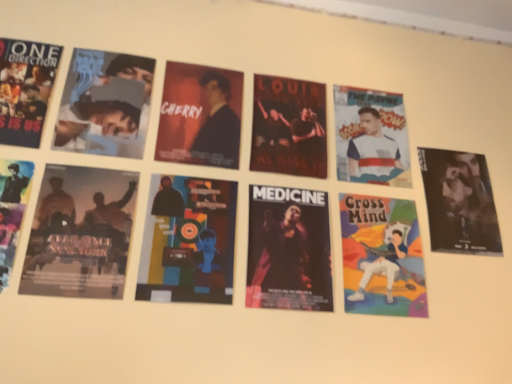
Question: From a real-world perspective, is matte black jacket at center, acting as the 3th person starting from the right, on top of silhouette paper poster at lower left, positioned as the 5th poster in right-to-left order?

Choices:
 (A) no
 (B) yes

Answer: (B)

Question: Considering the relative sizes of matte black jacket at center, the second person in the left-to-right sequence, and silhouette paper poster at lower left, positioned as the second poster in left-to-right order, in the image provided, is matte black jacket at center, the second person in the left-to-right sequence, wider than silhouette paper poster at lower left, positioned as the second poster in left-to-right order,?

Choices:
 (A) yes
 (B) no

Answer: (B)

Question: Is matte black jacket at center, the second person in the left-to-right sequence, positioned beyond the bounds of silhouette paper poster at lower left, positioned as the 5th poster in right-to-left order?

Choices:
 (A) no
 (B) yes

Answer: (B)

Question: Could you tell me if matte black jacket at center, the second person in the left-to-right sequence, is turned towards silhouette paper poster at lower left, positioned as the 5th poster in right-to-left order?

Choices:
 (A) no
 (B) yes

Answer: (A)

Question: Can you confirm if matte black jacket at center, acting as the 3th person starting from the right, is positioned to the left of silhouette paper poster at lower left, positioned as the second poster in left-to-right order?

Choices:
 (A) no
 (B) yes

Answer: (A)

Question: Is the position of matte black jacket at center, acting as the 3th person starting from the right, more distant than that of silhouette paper poster at lower left, positioned as the second poster in left-to-right order?

Choices:
 (A) no
 (B) yes

Answer: (B)

Question: Is shiny black jacket at right, the first person when ordered from right to left, completely or partially inside dark matte poster at center, arranged as the third poster when viewed from the right?

Choices:
 (A) no
 (B) yes

Answer: (A)

Question: Is dark matte poster at center, positioned as the fourth poster in left-to-right order, positioned far away from shiny black jacket at right, which is the fourth person in left-to-right order?

Choices:
 (A) yes
 (B) no

Answer: (B)

Question: Is dark matte poster at center, arranged as the third poster when viewed from the right, closer to the viewer compared to shiny black jacket at right, the first person when ordered from right to left?

Choices:
 (A) no
 (B) yes

Answer: (B)

Question: Is dark matte poster at center, positioned as the fourth poster in left-to-right order, with shiny black jacket at right, the first person when ordered from right to left?

Choices:
 (A) yes
 (B) no

Answer: (B)

Question: From the image's perspective, would you say dark matte poster at center, positioned as the fourth poster in left-to-right order, is shown under shiny black jacket at right, the first person when ordered from right to left?

Choices:
 (A) no
 (B) yes

Answer: (B)

Question: Is dark matte poster at center, positioned as the fourth poster in left-to-right order, facing away from shiny black jacket at right, the first person when ordered from right to left?

Choices:
 (A) yes
 (B) no

Answer: (B)

Question: Is matte black poster at left, which is the first poster in left-to-right order, smaller than multicolored paper at center, the fourth poster when ordered from right to left?

Choices:
 (A) yes
 (B) no

Answer: (B)